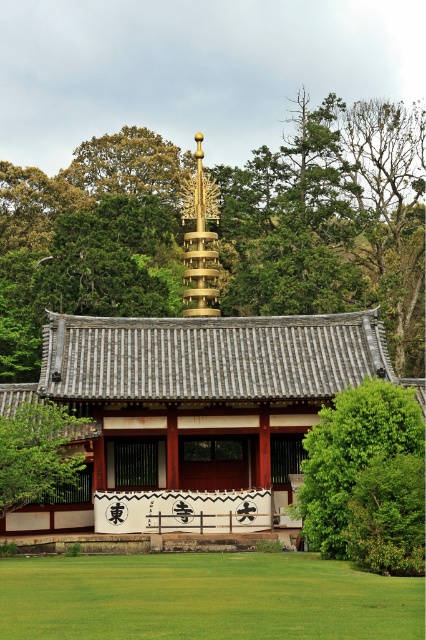
You are standing in front of the temple and see the green grass at lower center and the green leafy tree at right. Which one is located to the left of the other?

The green grass at lower center is positioned on the left side of green leafy tree at right.

You are standing in front of a traditional Japanese temple and notice a specific location marked on a map. The map indicates that there is green grass at lower center at point 0.936, 0.484. If you want to reach this exact spot, which direction should you move relative to your current position facing the temple?

Since the green grass at lower center is located at point (206, 598), which is towards the lower central area of the image, you should move forward towards the temple entrance and slightly to the right to reach the marked location.

You are standing in front of the traditional Japanese temple and notice two points marked on the image. The first point is at coordinates point (311, 204) and the second is at point (81, 628). Which point is closer to your eyes?

Point (311, 204) is further to the camera than point (81, 628), so the point closer to your eyes is point (81, 628).